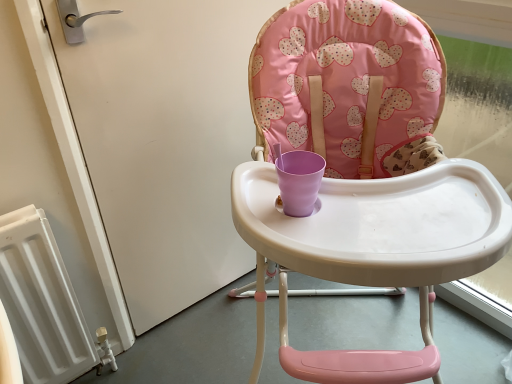
Identify the location of pink fabric highchair at center. This screenshot has height=384, width=512. (361, 181).

The width and height of the screenshot is (512, 384). Describe the element at coordinates (361, 181) in the screenshot. I see `pink fabric highchair at center` at that location.

Image resolution: width=512 pixels, height=384 pixels. What do you see at coordinates (164, 140) in the screenshot?
I see `white glossy screen door at left` at bounding box center [164, 140].

Identify the location of white glossy screen door at left. This screenshot has height=384, width=512. pos(164,140).

What is the approximate width of white glossy screen door at left?

2.90 inches.

Where is `pink fabric highchair at center`? The width and height of the screenshot is (512, 384). pink fabric highchair at center is located at coordinates (361, 181).

Considering the relative positions of white glossy screen door at left and pink fabric highchair at center in the image provided, is white glossy screen door at left to the right of pink fabric highchair at center from the viewer's perspective?

No, white glossy screen door at left is not to the right of pink fabric highchair at center.

Between white glossy screen door at left and pink fabric highchair at center, which one is positioned behind?

white glossy screen door at left is further from the camera.

Is point (106, 123) positioned before point (463, 191)?

No, it is not.

From the image's perspective, which object appears higher, white glossy screen door at left or pink fabric highchair at center?

white glossy screen door at left appears higher in the image.

From a real-world perspective, is white glossy screen door at left on pink fabric highchair at center?

Yes.

Considering the sizes of white glossy screen door at left and pink fabric highchair at center in the image, is white glossy screen door at left wider or thinner than pink fabric highchair at center?

Considering their sizes, white glossy screen door at left looks slimmer than pink fabric highchair at center.

Considering the relative sizes of white glossy screen door at left and pink fabric highchair at center in the image provided, is white glossy screen door at left taller than pink fabric highchair at center?

No, white glossy screen door at left is not taller than pink fabric highchair at center.

Is white glossy screen door at left bigger or smaller than pink fabric highchair at center?

In the image, white glossy screen door at left appears to be smaller than pink fabric highchair at center.

Is white glossy screen door at left situated inside pink fabric highchair at center or outside?

white glossy screen door at left is not inside pink fabric highchair at center, it's outside.

Are white glossy screen door at left and pink fabric highchair at center located far from each other?

white glossy screen door at left is actually quite close to pink fabric highchair at center.

Does white glossy screen door at left turn towards pink fabric highchair at center?

Yes, white glossy screen door at left faces towards pink fabric highchair at center.

Can you tell me how much white glossy screen door at left and pink fabric highchair at center differ in facing direction?

41.9 degrees.

In the image, there is a white glossy screen door at left. Where is `chair below it (from the image's perspective)`? This screenshot has height=384, width=512. chair below it (from the image's perspective) is located at coordinates (361, 181).

Which is more to the right, pink fabric highchair at center or white glossy screen door at left?

pink fabric highchair at center is more to the right.

Is pink fabric highchair at center behind white glossy screen door at left?

No, it is not.

Does point (394, 351) come behind point (182, 41)?

Yes, it is.

From the image's perspective, who appears lower, pink fabric highchair at center or white glossy screen door at left?

pink fabric highchair at center appears lower in the image.

From a real-world perspective, which object stands above the other?

From a 3D spatial view, white glossy screen door at left is above.

Which object is wider, pink fabric highchair at center or white glossy screen door at left?

With larger width is pink fabric highchair at center.

In the scene shown: Does pink fabric highchair at center have a greater height compared to white glossy screen door at left?

Correct, pink fabric highchair at center is much taller as white glossy screen door at left.

Considering the relative sizes of pink fabric highchair at center and white glossy screen door at left in the image provided, is pink fabric highchair at center bigger than white glossy screen door at left?

Correct, pink fabric highchair at center is larger in size than white glossy screen door at left.

Is pink fabric highchair at center inside or outside of white glossy screen door at left?

pink fabric highchair at center is outside white glossy screen door at left.

Is pink fabric highchair at center not near white glossy screen door at left?

No, pink fabric highchair at center is not far from white glossy screen door at left.

Is pink fabric highchair at center looking in the opposite direction of white glossy screen door at left?

No, white glossy screen door at left is not at the back of pink fabric highchair at center.

How distant is pink fabric highchair at center from white glossy screen door at left?

pink fabric highchair at center and white glossy screen door at left are 16.98 inches apart from each other.

You are a GUI agent. You are given a task and a screenshot of the screen. Output one action in this format:
    pyautogui.click(x=<x>, y=<y>)
    Task: Click on the chair beneath the white glossy screen door at left (from a real-world perspective)
    This screenshot has height=384, width=512.
    Given the screenshot: What is the action you would take?
    pyautogui.click(x=361, y=181)

Where is `screen door above the pink fabric highchair at center (from a real-world perspective)`? Image resolution: width=512 pixels, height=384 pixels. screen door above the pink fabric highchair at center (from a real-world perspective) is located at coordinates (164, 140).

The height and width of the screenshot is (384, 512). I want to click on chair on the right of white glossy screen door at left, so click(x=361, y=181).